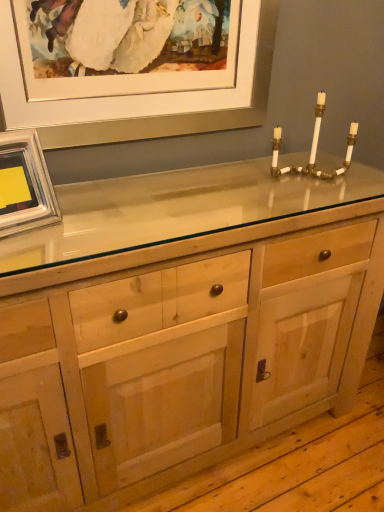
The image size is (384, 512). In order to click on unoccupied space behind white ceramic candle holder at upper right in this screenshot , I will do `click(294, 162)`.